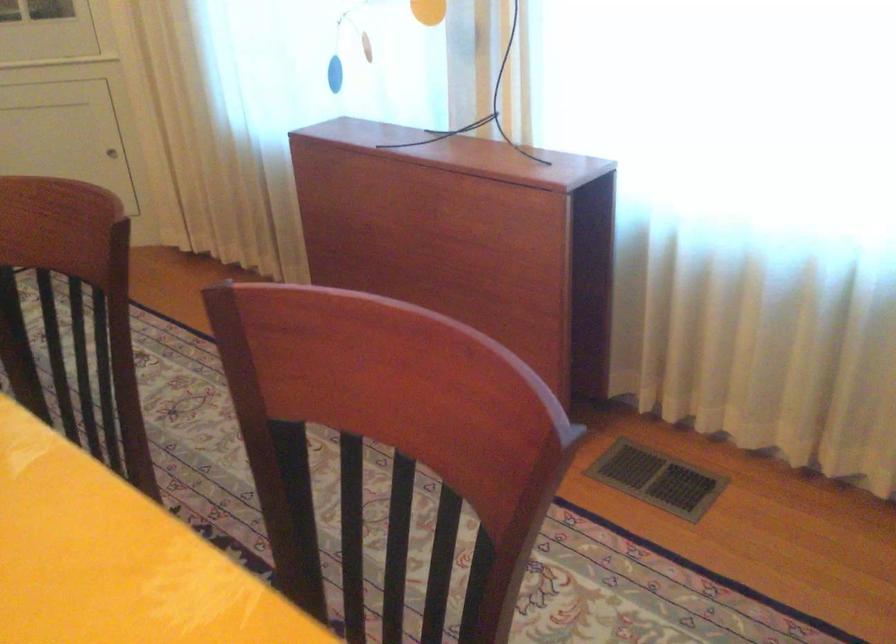
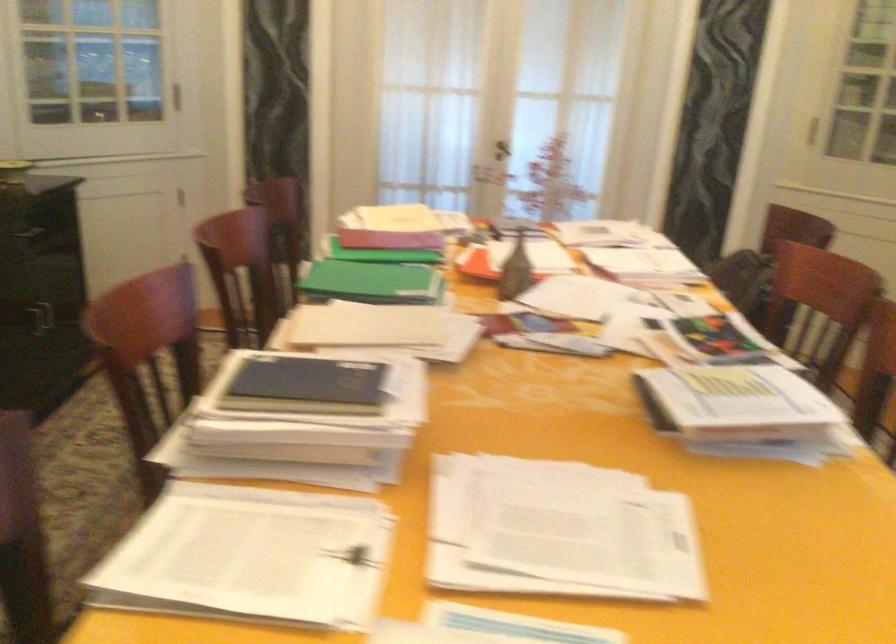
Question: The first image is from the beginning of the video and the second image is from the end. How did the camera likely rotate when shooting the video?

Choices:
 (A) Left
 (B) Right
 (C) Up
 (D) Down

Answer: (A)